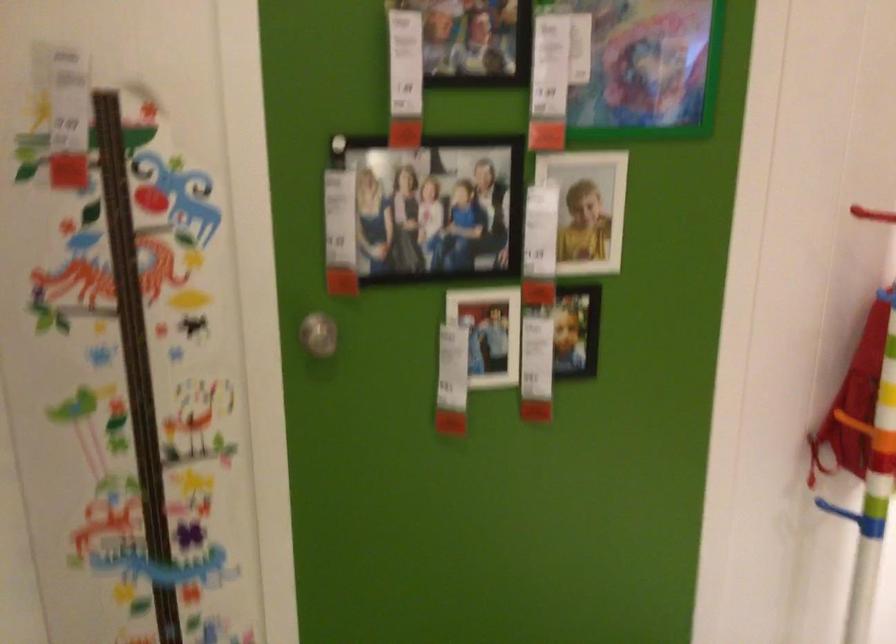
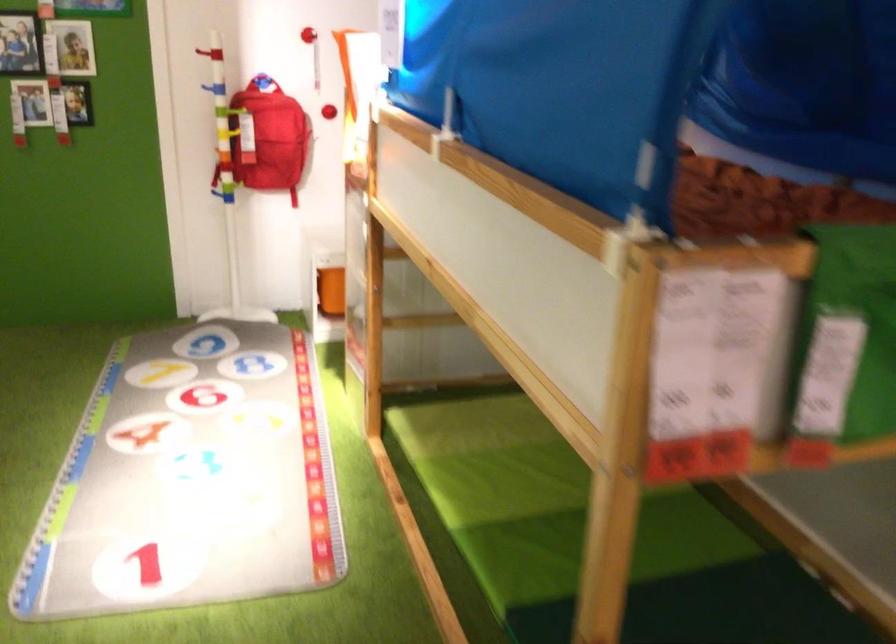
What movement of the cameraman would produce the second image?

The movement direction of the cameraman is right, backward.